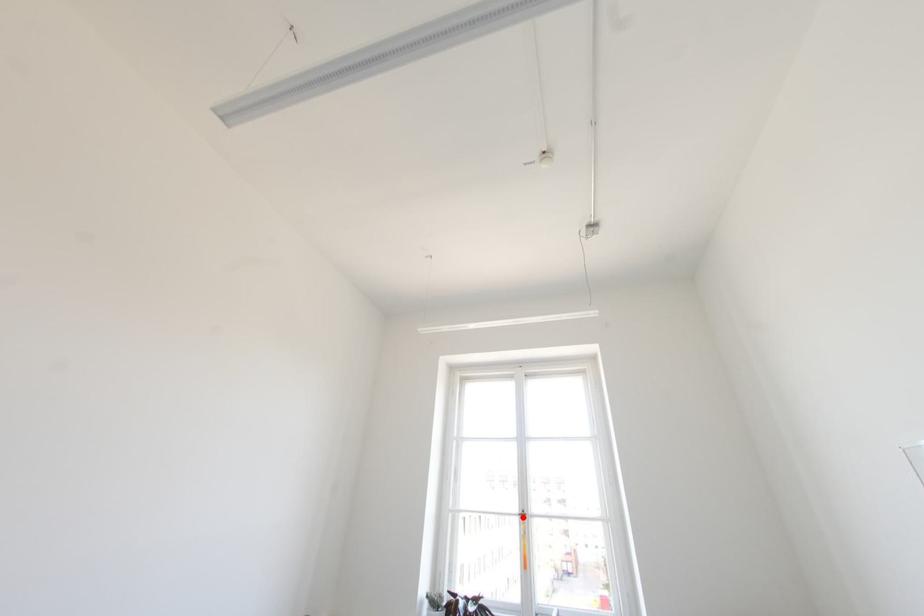
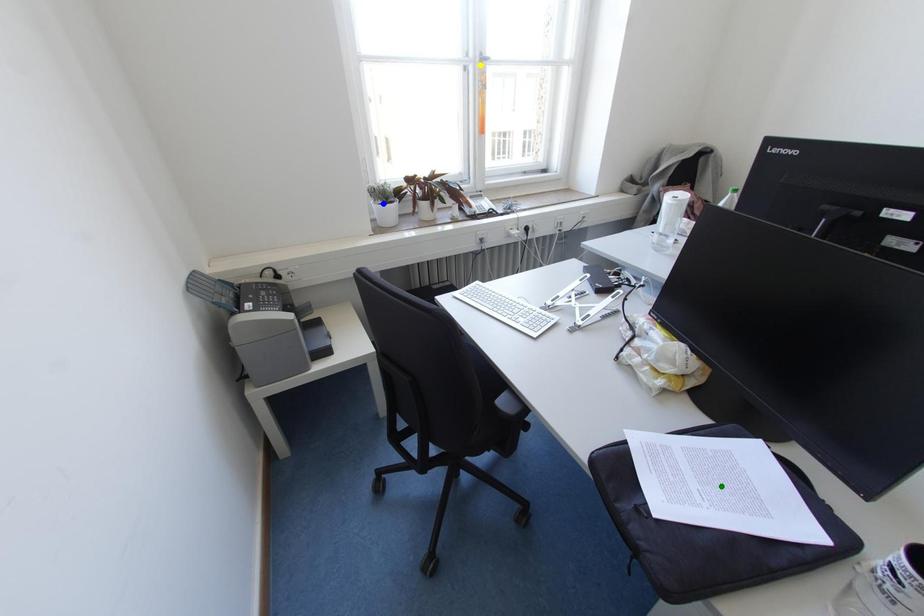
Question: I am providing you with two images of the same scene from different viewpoints. A red point is marked on the first image. You are given multiple points on the second image. Which point in image 2 represents the same 3d spot as the red point in image 1?

Choices:
 (A) yellow point
 (B) blue point
 (C) green point

Answer: (A)